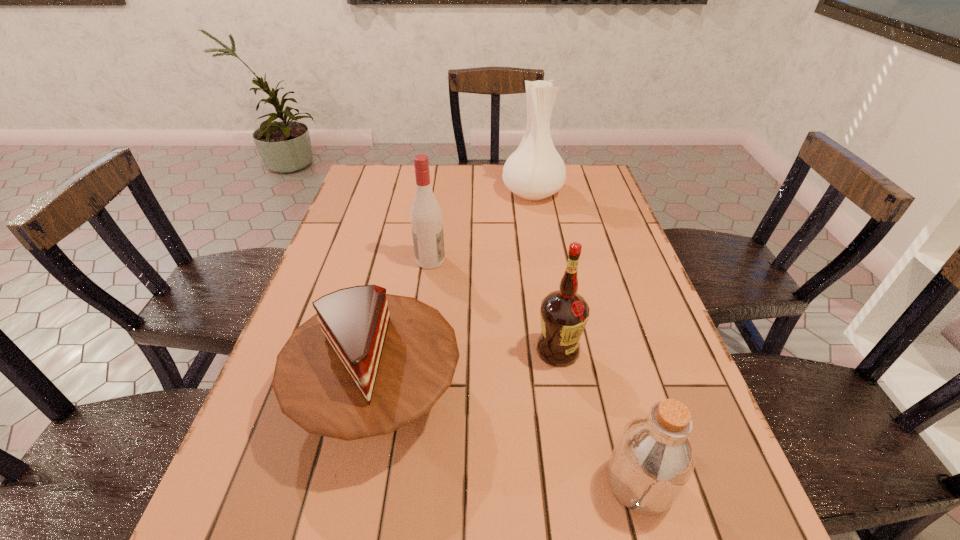
I want to click on vacant point located between the right alcohol and the vase, so click(545, 271).

Where is `blank region between the bottle and the fourth nearest object`? blank region between the bottle and the fourth nearest object is located at coordinates (535, 372).

I want to click on vacant space that's between the farthest object and the bottle, so click(x=587, y=338).

Image resolution: width=960 pixels, height=540 pixels. I want to click on free point between the vase and the nearer alcohol, so click(545, 271).

Where is `vacant space that's between the farthest object and the bottle`? This screenshot has height=540, width=960. vacant space that's between the farthest object and the bottle is located at coordinates (587, 338).

Where is `empty location between the nearer alcohol and the cake`? empty location between the nearer alcohol and the cake is located at coordinates (468, 373).

You are a GUI agent. You are given a task and a screenshot of the screen. Output one action in this format:
    pyautogui.click(x=<x>, y=<y>)
    Task: Click on the free space between the farthest object and the nearer alcohol
    The height and width of the screenshot is (540, 960).
    Given the screenshot: What is the action you would take?
    pyautogui.click(x=545, y=271)

Where is `the second closest object to the cake`? The width and height of the screenshot is (960, 540). the second closest object to the cake is located at coordinates (426, 219).

Locate an element on the screen. object that ranks as the second closest to the right alcohol is located at coordinates (653, 459).

Where is `vacant point that satisfies the following two spatial constraints: 1. on the front side of the cake; 2. on the right side of the bottle`? The height and width of the screenshot is (540, 960). vacant point that satisfies the following two spatial constraints: 1. on the front side of the cake; 2. on the right side of the bottle is located at coordinates (361, 483).